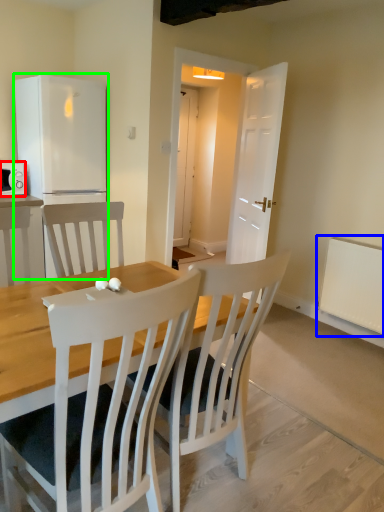
Question: Considering the real-world distances, which object is farthest from microwave oven (highlighted by a red box)? radiator (highlighted by a blue box) or refrigerator (highlighted by a green box)?

Choices:
 (A) radiator
 (B) refrigerator

Answer: (A)